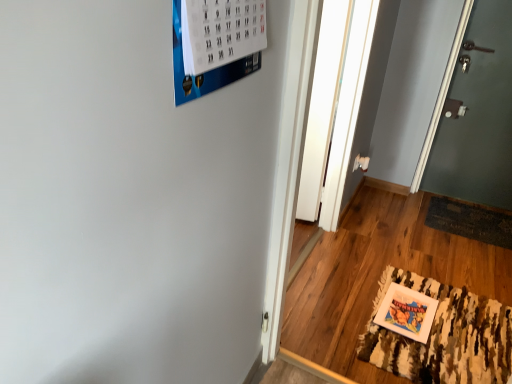
This screenshot has width=512, height=384. What are the coordinates of `blank area beneath camouflage-patterned rug at lower right (from a real-world perspective)` in the screenshot? It's located at (443, 328).